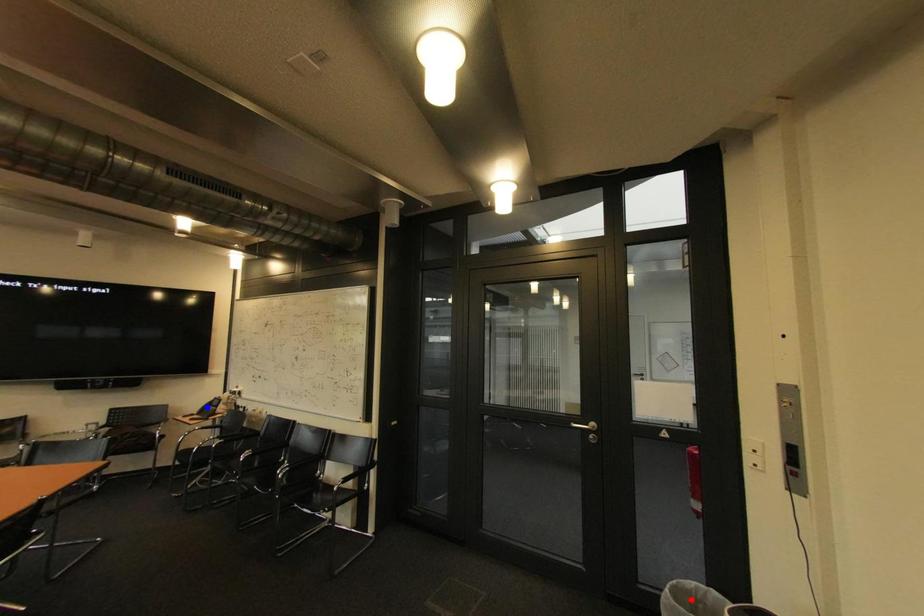
Question: Which of the two points in the image is closer to the camera?

Choices:
 (A) Blue point is closer.
 (B) Red point is closer.

Answer: (B)